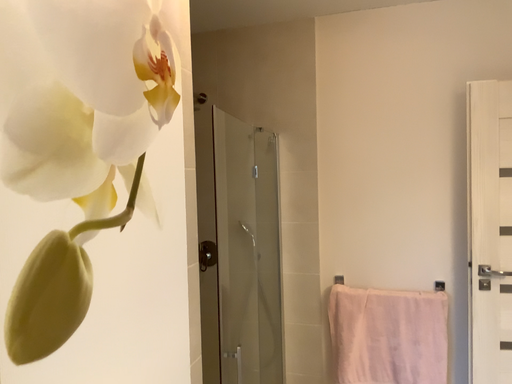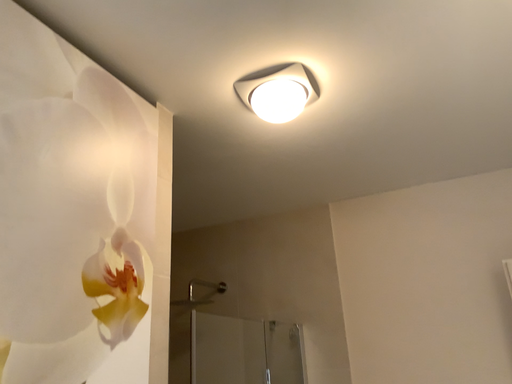
Question: How did the camera likely rotate when shooting the video?

Choices:
 (A) rotated upward
 (B) rotated downward

Answer: (A)